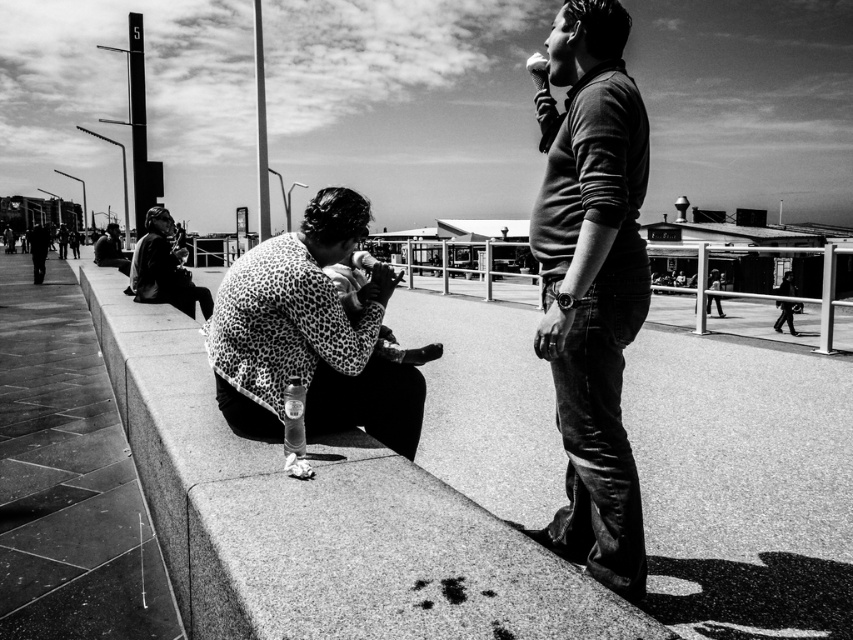
Is granite ledge at lower left bigger than leopard print jacket at center?

No.

Is granite ledge at lower left shorter than leopard print jacket at center?

Indeed, granite ledge at lower left has a lesser height compared to leopard print jacket at center.

I want to click on granite ledge at lower left, so click(x=318, y=518).

Does granite ledge at lower left have a smaller size compared to leopard print sweater at lower center?

Yes.

Which is behind, point (291, 589) or point (289, 355)?

The point (289, 355) is behind.

The image size is (853, 640). What are the coordinates of `granite ledge at lower left` in the screenshot? It's located at (318, 518).

Identify the location of granite ledge at lower left. The width and height of the screenshot is (853, 640). [x=318, y=518].

Between granite ledge at lower left and matte brown sweater at center, which one is positioned lower?

granite ledge at lower left is lower down.

Between point (271, 532) and point (618, 481), which one is positioned behind?

The point (618, 481) is more distant.

I want to click on granite ledge at lower left, so click(x=318, y=518).